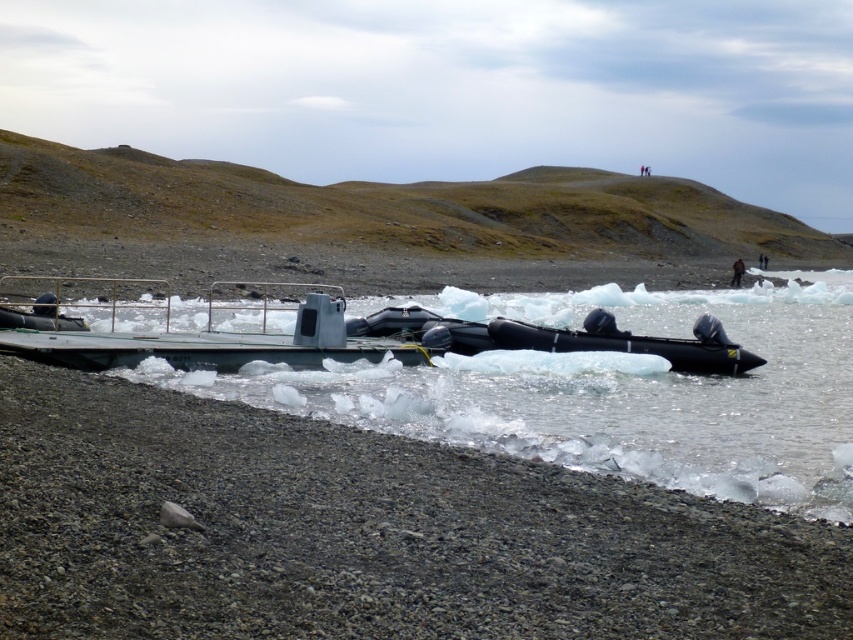
Question: Which point is closer to the camera?

Choices:
 (A) (737, 275)
 (B) (724, 419)
 (C) (566, 342)

Answer: (B)

Question: Among these points, which one is nearest to the camera?

Choices:
 (A) pos(741,260)
 (B) pos(747,449)
 (C) pos(637,346)
 (D) pos(712,516)

Answer: (D)

Question: Does gray gravel shore at lower left appear under brown fuzzy jacket at upper right?

Choices:
 (A) yes
 (B) no

Answer: (A)

Question: Is gray gravel shore at lower left closer to camera compared to black rubber boat at lower center?

Choices:
 (A) yes
 (B) no

Answer: (A)

Question: Among these points, which one is nearest to the camera?

Choices:
 (A) (650, 342)
 (B) (538, 362)

Answer: (B)

Question: Is gray gravel shore at lower left closer to the viewer compared to brown fuzzy jacket at upper right?

Choices:
 (A) no
 (B) yes

Answer: (B)